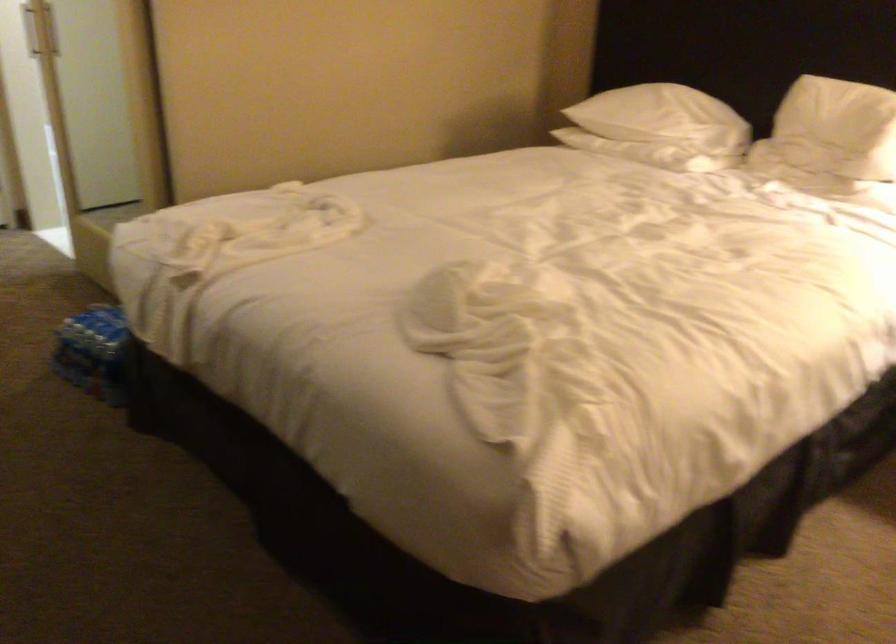
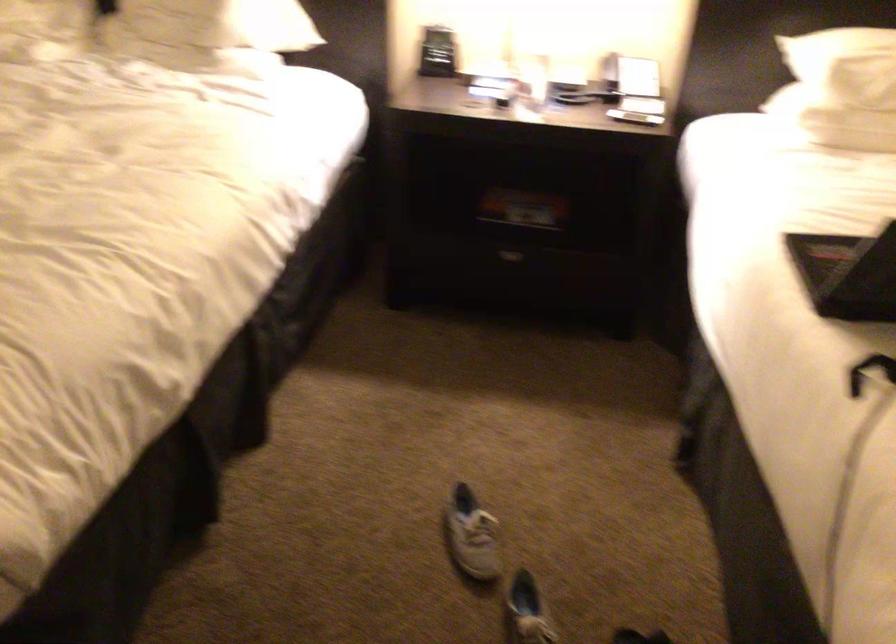
Question: The first image is from the beginning of the video and the second image is from the end. How did the camera likely rotate when shooting the video?

Choices:
 (A) Left
 (B) Right
 (C) Up
 (D) Down

Answer: (B)